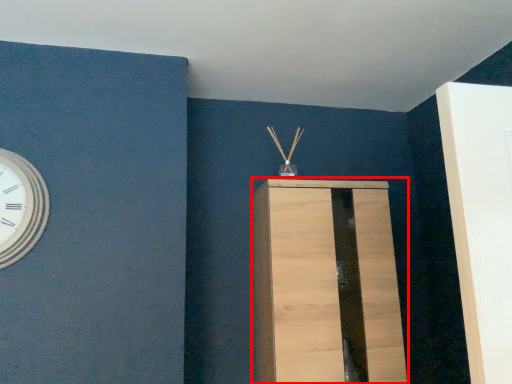
Question: From the image's perspective, considering the relative positions of furniture (annotated by the red box) and wall clock in the image provided, where is furniture (annotated by the red box) located with respect to the staircase?

Choices:
 (A) below
 (B) above

Answer: (A)